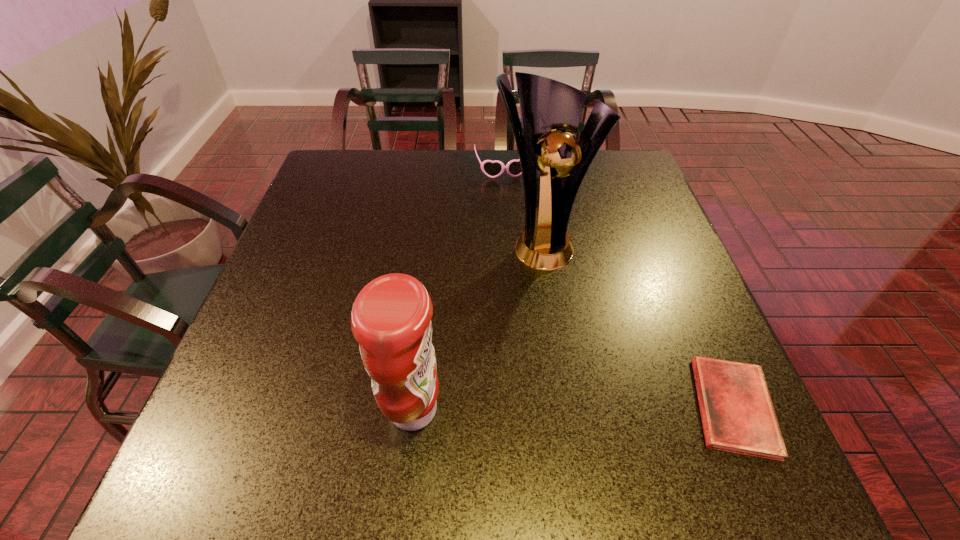
Locate an element on the screen. Image resolution: width=960 pixels, height=540 pixels. vacant space on the desktop that is between the third shortest object and the shortest object and is positioned on the front-facing side of the sunglasses is located at coordinates (554, 408).

Locate an element on the screen. This screenshot has width=960, height=540. vacant spot on the desktop that is between the leftmost object and the shortest object and is positioned at the front of the third nearest object, where the globe is visible is located at coordinates (619, 408).